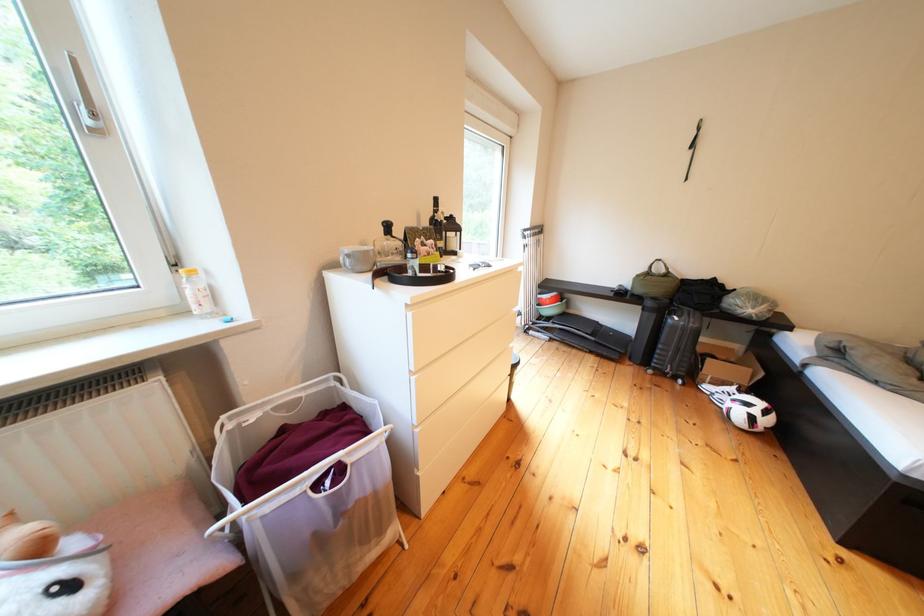
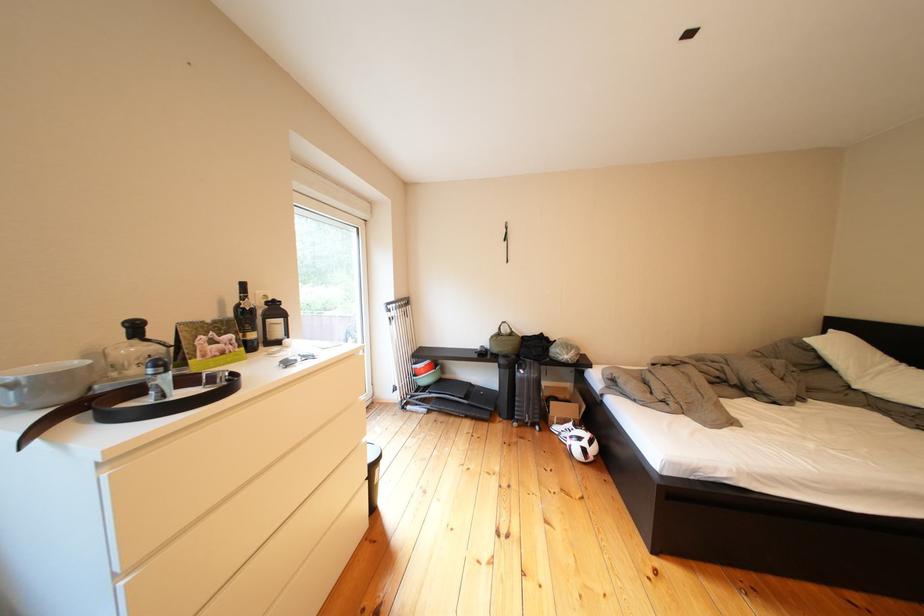
Find the pixel in the second image that matches point (723, 392) in the first image.

(570, 432)